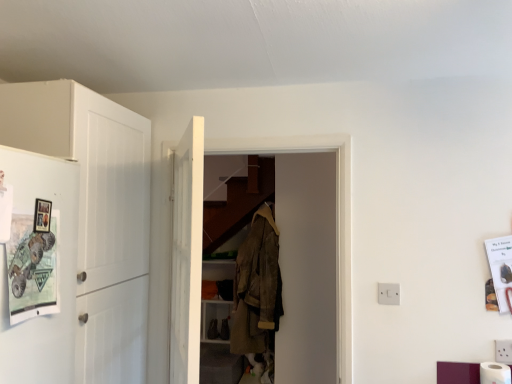
Question: Is white wooden door at center positioned before white matte toilet paper at lower right?

Choices:
 (A) no
 (B) yes

Answer: (B)

Question: Does white wooden door at center have a greater width compared to white matte toilet paper at lower right?

Choices:
 (A) yes
 (B) no

Answer: (A)

Question: Does white wooden door at center have a lesser width compared to white matte toilet paper at lower right?

Choices:
 (A) yes
 (B) no

Answer: (B)

Question: Is white wooden door at center positioned far away from white matte toilet paper at lower right?

Choices:
 (A) no
 (B) yes

Answer: (B)

Question: From the image's perspective, is white wooden door at center beneath white matte toilet paper at lower right?

Choices:
 (A) no
 (B) yes

Answer: (A)

Question: Looking at the image, does matte white fridge at left seem bigger or smaller compared to white plastic electric outlet at center right?

Choices:
 (A) big
 (B) small

Answer: (A)

Question: From a real-world perspective, is matte white fridge at left physically located above or below white plastic electric outlet at center right?

Choices:
 (A) above
 (B) below

Answer: (A)

Question: Looking at their shapes, would you say matte white fridge at left is wider or thinner than white plastic electric outlet at center right?

Choices:
 (A) wide
 (B) thin

Answer: (A)

Question: Do you think matte white fridge at left is within white plastic electric outlet at center right, or outside of it?

Choices:
 (A) inside
 (B) outside

Answer: (B)

Question: Considering the positions of matte white fridge at left and white matte cabinet at left in the image, is matte white fridge at left wider or thinner than white matte cabinet at left?

Choices:
 (A) wide
 (B) thin

Answer: (B)

Question: From the image's perspective, is matte white fridge at left above or below white matte cabinet at left?

Choices:
 (A) above
 (B) below

Answer: (A)

Question: Considering the positions of point (11, 354) and point (90, 347), is point (11, 354) closer or farther from the camera than point (90, 347)?

Choices:
 (A) closer
 (B) farther

Answer: (A)

Question: Relative to white matte cabinet at left, is matte white fridge at left in front or behind?

Choices:
 (A) front
 (B) behind

Answer: (A)

Question: In terms of size, does camouflage fabric jacket at center appear bigger or smaller than white matte cabinet at left?

Choices:
 (A) small
 (B) big

Answer: (A)

Question: Considering the positions of point (259, 296) and point (46, 119), is point (259, 296) closer or farther from the camera than point (46, 119)?

Choices:
 (A) closer
 (B) farther

Answer: (B)